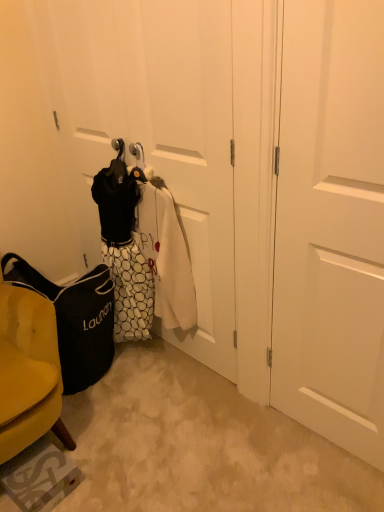
Locate an element on the screen. This screenshot has height=512, width=384. white matte door at center right is located at coordinates (331, 225).

Find the location of a particular element. The width and height of the screenshot is (384, 512). white dotted fabric laundry at center is located at coordinates (143, 248).

The image size is (384, 512). I want to click on white matte door at center right, so click(x=331, y=225).

Is point (67, 341) in front of point (102, 208)?

That is True.

Does black fabric laundry bag at lower left contain white dotted fabric laundry at center?

No, white dotted fabric laundry at center is not inside black fabric laundry bag at lower left.

From the picture: From a real-world perspective, is black fabric laundry bag at lower left physically located above or below white dotted fabric laundry at center?

black fabric laundry bag at lower left is situated lower than white dotted fabric laundry at center in the real world.

Who is shorter, black fabric laundry bag at lower left or white dotted fabric laundry at center?

black fabric laundry bag at lower left.

Considering the relative positions of white dotted fabric laundry at center and black fabric laundry bag at lower left in the image provided, is white dotted fabric laundry at center to the left of black fabric laundry bag at lower left from the viewer's perspective?

No, white dotted fabric laundry at center is not to the left of black fabric laundry bag at lower left.

From a real-world perspective, who is located higher, white dotted fabric laundry at center or black fabric laundry bag at lower left?

white dotted fabric laundry at center.

Which of these two, white dotted fabric laundry at center or black fabric laundry bag at lower left, stands shorter?

Standing shorter between the two is black fabric laundry bag at lower left.

From the image's perspective, which object appears higher, white matte door at center right or white dotted fabric laundry at center?

From the image's view, white dotted fabric laundry at center is above.

Locate an element on the screen. door on the right of white dotted fabric laundry at center is located at coordinates [331, 225].

Is white matte door at center right positioned far away from white dotted fabric laundry at center?

white matte door at center right is actually quite close to white dotted fabric laundry at center.

Which object is thinner, white matte door at center right or white dotted fabric laundry at center?

Thinner between the two is white matte door at center right.

Which is more to the right, white matte door at center right or black fabric laundry bag at lower left?

From the viewer's perspective, white matte door at center right appears more on the right side.

Identify the location of door that is above the black fabric laundry bag at lower left (from a real-world perspective). (331, 225).

Is white matte door at center right further to the viewer compared to black fabric laundry bag at lower left?

No.

Considering the points (357, 60) and (74, 322), which point is behind, point (357, 60) or point (74, 322)?

The point (74, 322) is more distant.

Between black fabric laundry bag at lower left and white matte door at center right, which one has larger size?

black fabric laundry bag at lower left is bigger.

Is black fabric laundry bag at lower left inside or outside of white matte door at center right?

black fabric laundry bag at lower left is not inside white matte door at center right, it's outside.

Is the depth of black fabric laundry bag at lower left greater than that of white matte door at center right?

Yes, it is.

In the scene shown: From the image's perspective, is black fabric laundry bag at lower left located beneath white matte door at center right?

Yes, from the image's perspective, black fabric laundry bag at lower left is below white matte door at center right.

Looking at this image, is white dotted fabric laundry at center taller or shorter than white matte door at center right?

Considering their sizes, white dotted fabric laundry at center has less height than white matte door at center right.

In the scene shown: Does white dotted fabric laundry at center lie in front of white matte door at center right?

No.

Between white dotted fabric laundry at center and white matte door at center right, which one has smaller size?

white matte door at center right.

What are the coordinates of `handbag below the white dotted fabric laundry at center (from a real-world perspective)` in the screenshot? It's located at (75, 320).

Identify the location of laundry in front of the black fabric laundry bag at lower left. (143, 248).

From the image, which object appears to be farther from white matte door at center right, white dotted fabric laundry at center or black fabric laundry bag at lower left?

black fabric laundry bag at lower left.

Considering their positions, is white matte door at center right positioned further to black fabric laundry bag at lower left than white dotted fabric laundry at center?

white matte door at center right.

Based on their spatial positions, is black fabric laundry bag at lower left or white matte door at center right further from white dotted fabric laundry at center?

The object further to white dotted fabric laundry at center is white matte door at center right.

Which object lies nearer to the anchor point black fabric laundry bag at lower left, white dotted fabric laundry at center or white matte door at center right?

Among the two, white dotted fabric laundry at center is located nearer to black fabric laundry bag at lower left.

Looking at this image, looking at the image, which one is located closer to white dotted fabric laundry at center, white matte door at center right or black fabric laundry bag at lower left?

The object closer to white dotted fabric laundry at center is black fabric laundry bag at lower left.

Considering their positions, is black fabric laundry bag at lower left positioned further to white matte door at center right than white dotted fabric laundry at center?

Among the two, black fabric laundry bag at lower left is located further to white matte door at center right.

Locate an element on the screen. laundry between black fabric laundry bag at lower left and white matte door at center right is located at coordinates (143, 248).